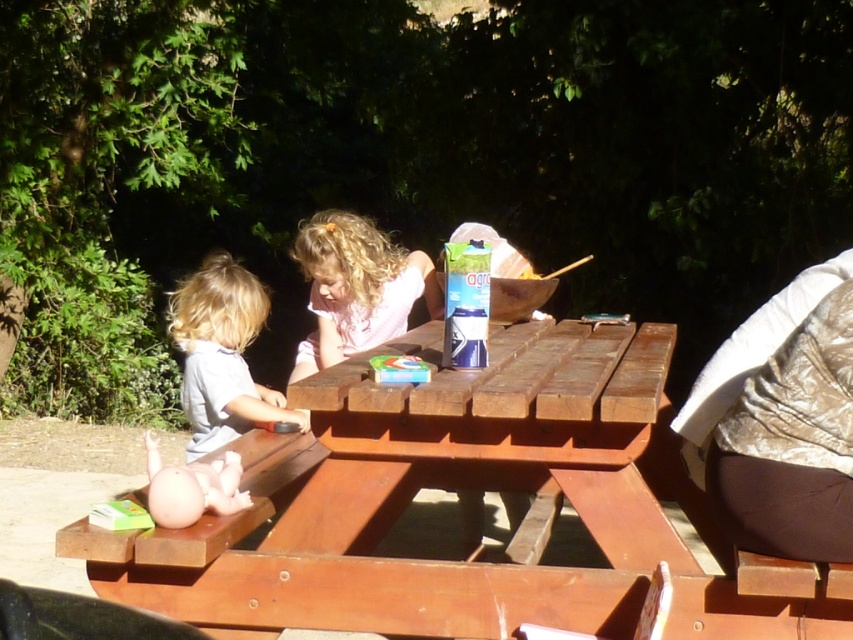
Between blonde hair girl at center and smooth gray shirt at left, which one is positioned higher?

Positioned higher is blonde hair girl at center.

Does point (440, 305) come behind point (184, 292)?

Yes, it is.

Is point (378, 280) behind point (204, 444)?

Yes.

I want to click on blonde hair girl at center, so click(x=357, y=288).

In the scene shown: Is wooden picnic table at center behind blonde hair girl at center?

That is False.

Identify the location of wooden picnic table at center. This screenshot has height=640, width=853. (502, 397).

Locate an element on the screen. Image resolution: width=853 pixels, height=640 pixels. wooden picnic table at center is located at coordinates (502, 397).

Is wooden picnic table at center to the left of smooth gray shirt at left from the viewer's perspective?

No, wooden picnic table at center is not to the left of smooth gray shirt at left.

Find the location of `wooden picnic table at center`. wooden picnic table at center is located at coordinates click(x=502, y=397).

Identify the location of wooden picnic table at center. (502, 397).